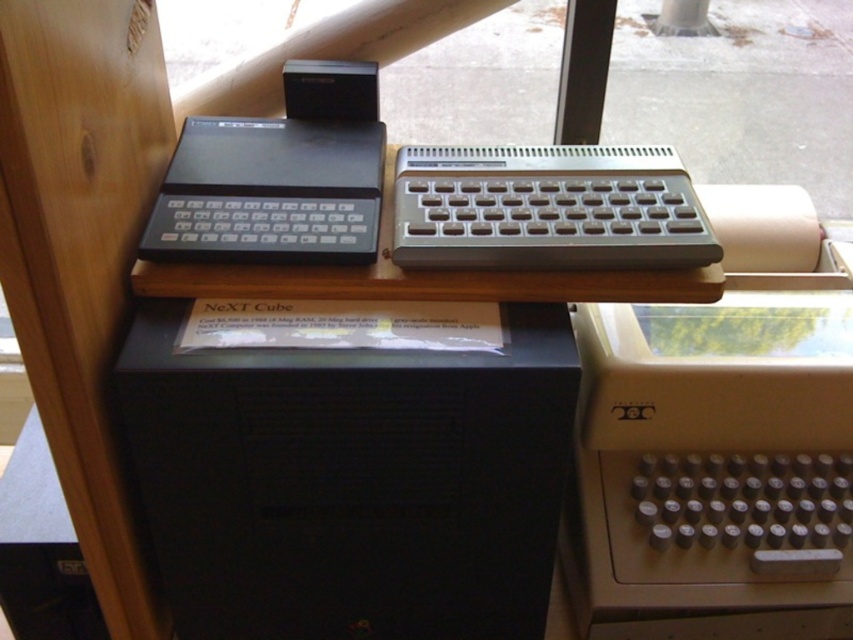
You are a museum visitor who wants to take a photo of the black plastic next cube at center and the metallic silver keyboard at center together in one frame. Based on their current positions, do you think they can fit in the camera view without moving anything?

The black plastic next cube at center and metallic silver keyboard at center are 7.11 inches apart from each other. Since the distance between them is relatively small, it is likely that both items can fit within the camera view without needing to adjust their positions.

You are a museum visitor who wants to take a photo of the black plastic next cube at center and the metallic silver keyboard at center. To ensure both are in the frame, which object should you position closer to the camera?

The black plastic next cube at center is positioned on the left side of metallic silver keyboard at center. To include both in the photo, position the camera so that the black plastic next cube at center is closer to the camera since it is on the left side, ensuring both are within the frame.

You are a museum visitor who wants to take a photo of the black plastic next cube at center and the black plastic keyboard at left. Since you want both items to be clearly visible in the frame, which object should you focus on to ensure proper focus given their sizes?

The black plastic next cube at center is bigger than the black plastic keyboard at left, so focusing on the larger object, the black plastic next cube at center, will help ensure both are in focus as it occupies more of the frame.